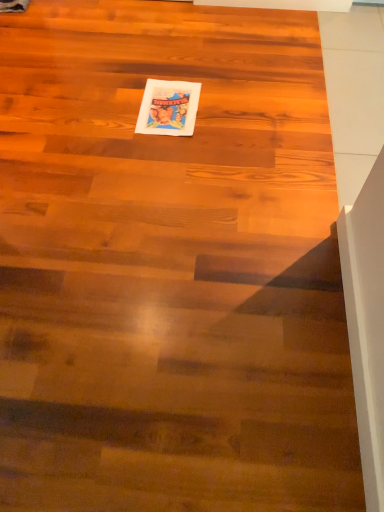
Where is `free space above white paper book at center (from a real-world perspective)`? The height and width of the screenshot is (512, 384). free space above white paper book at center (from a real-world perspective) is located at coordinates click(168, 101).